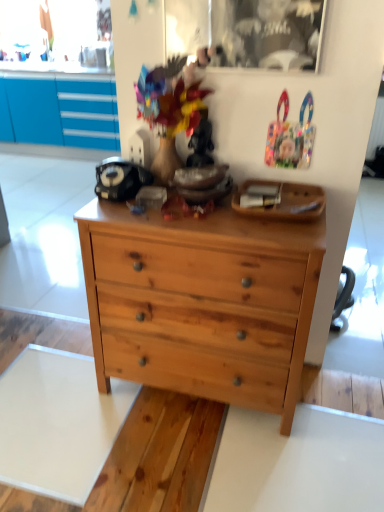
Measure the distance between transparent glass picture frame at upper center and camera.

4.10 feet.

The height and width of the screenshot is (512, 384). I want to click on transparent glass picture frame at upper center, so click(x=247, y=31).

Is natural wood chest of drawers at center facing away from wooden tray at upper center?

natural wood chest of drawers at center does not have its back to wooden tray at upper center.

In the image, is natural wood chest of drawers at center on the left side or the right side of wooden tray at upper center?

natural wood chest of drawers at center is to the left of wooden tray at upper center.

Does point (98, 203) come behind point (296, 206)?

Yes, point (98, 203) is farther from viewer.

Consider the image. Is natural wood chest of drawers at center taller than wooden tray at upper center?

Correct, natural wood chest of drawers at center is much taller as wooden tray at upper center.

Between natural wood chest of drawers at center and transparent glass picture frame at upper center, which one has larger width?

natural wood chest of drawers at center.

Which is behind, point (280, 430) or point (265, 13)?

The point (280, 430) is behind.

Does transparent glass picture frame at upper center touch natural wood chest of drawers at center?

No, transparent glass picture frame at upper center is not next to natural wood chest of drawers at center.

Is transparent glass picture frame at upper center smaller than natural wood chest of drawers at center?

Yes, transparent glass picture frame at upper center is smaller than natural wood chest of drawers at center.

From the image's perspective, is transparent glass picture frame at upper center under natural wood chest of drawers at center?

No, from the image's perspective, transparent glass picture frame at upper center is not below natural wood chest of drawers at center.

In the image, is transparent glass picture frame at upper center positioned in front of or behind natural wood chest of drawers at center?

transparent glass picture frame at upper center is positioned farther from the viewer than natural wood chest of drawers at center.

Is wooden tray at upper center touching natural wood chest of drawers at center?

No, wooden tray at upper center is not making contact with natural wood chest of drawers at center.

Between wooden tray at upper center and natural wood chest of drawers at center, which one has smaller width?

With smaller width is wooden tray at upper center.

Could you tell me if wooden tray at upper center is facing natural wood chest of drawers at center?

No, wooden tray at upper center is not oriented towards natural wood chest of drawers at center.

Considering the relative sizes of wooden tray at upper center and natural wood chest of drawers at center in the image provided, is wooden tray at upper center bigger than natural wood chest of drawers at center?

Incorrect, wooden tray at upper center is not larger than natural wood chest of drawers at center.

Is transparent glass picture frame at upper center inside the boundaries of wooden tray at upper center, or outside?

transparent glass picture frame at upper center is not inside wooden tray at upper center, it's outside.

Is the surface of transparent glass picture frame at upper center in direct contact with wooden tray at upper center?

No, transparent glass picture frame at upper center is not with wooden tray at upper center.

Does transparent glass picture frame at upper center have a larger size compared to wooden tray at upper center?

Incorrect, transparent glass picture frame at upper center is not larger than wooden tray at upper center.

From a real-world perspective, relative to wooden tray at upper center, is transparent glass picture frame at upper center vertically above or below?

In terms of real-world spatial position, transparent glass picture frame at upper center is above wooden tray at upper center.

Is wooden tray at upper center oriented away from transparent glass picture frame at upper center?

No, wooden tray at upper center is not facing the opposite direction of transparent glass picture frame at upper center.

Are wooden tray at upper center and transparent glass picture frame at upper center located far from each other?

No.

Image resolution: width=384 pixels, height=512 pixels. Identify the location of plate in front of the transparent glass picture frame at upper center. (284, 201).

Is wooden tray at upper center shorter than transparent glass picture frame at upper center?

Yes, wooden tray at upper center is shorter than transparent glass picture frame at upper center.

You are a GUI agent. You are given a task and a screenshot of the screen. Output one action in this format:
    pyautogui.click(x=<x>, y=<y>)
    Task: Click on the plate on the right of natural wood chest of drawers at center
    The image size is (384, 512).
    Given the screenshot: What is the action you would take?
    pyautogui.click(x=284, y=201)

Find the location of a particular element. The image size is (384, 512). chest of drawers below the transparent glass picture frame at upper center (from a real-world perspective) is located at coordinates (202, 302).

In the scene shown: Considering their positions, is transparent glass picture frame at upper center positioned further to wooden tray at upper center than natural wood chest of drawers at center?

The object further to wooden tray at upper center is transparent glass picture frame at upper center.

Looking at the image, which one is located closer to transparent glass picture frame at upper center, natural wood chest of drawers at center or wooden tray at upper center?

Among the two, wooden tray at upper center is located nearer to transparent glass picture frame at upper center.

Looking at the image, which one is located closer to natural wood chest of drawers at center, wooden tray at upper center or transparent glass picture frame at upper center?

wooden tray at upper center.

Which object lies further to the anchor point natural wood chest of drawers at center, transparent glass picture frame at upper center or wooden tray at upper center?

Based on the image, transparent glass picture frame at upper center appears to be further to natural wood chest of drawers at center.

Estimate the real-world distances between objects in this image. Which object is further from transparent glass picture frame at upper center, wooden tray at upper center or natural wood chest of drawers at center?

natural wood chest of drawers at center is positioned further to the anchor transparent glass picture frame at upper center.

From the image, which object appears to be nearer to wooden tray at upper center, natural wood chest of drawers at center or transparent glass picture frame at upper center?

Among the two, natural wood chest of drawers at center is located nearer to wooden tray at upper center.

Locate an element on the screen. This screenshot has height=512, width=384. plate between transparent glass picture frame at upper center and natural wood chest of drawers at center in the up-down direction is located at coordinates (284, 201).